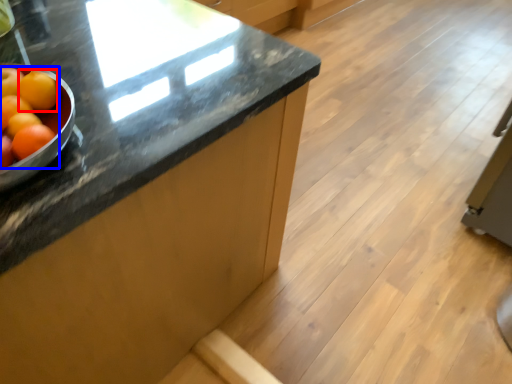
Question: Which object is closer to the camera taking this photo, tangerine (highlighted by a red box) or grapefruit (highlighted by a blue box)?

Choices:
 (A) tangerine
 (B) grapefruit

Answer: (B)